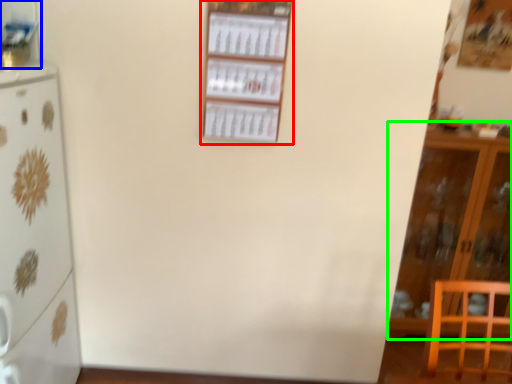
Question: Based on their relative distances, which object is nearer to shelf (highlighted by a red box)? Choose from shelf (highlighted by a blue box) and cabinetry (highlighted by a green box).

Choices:
 (A) shelf
 (B) cabinetry

Answer: (A)